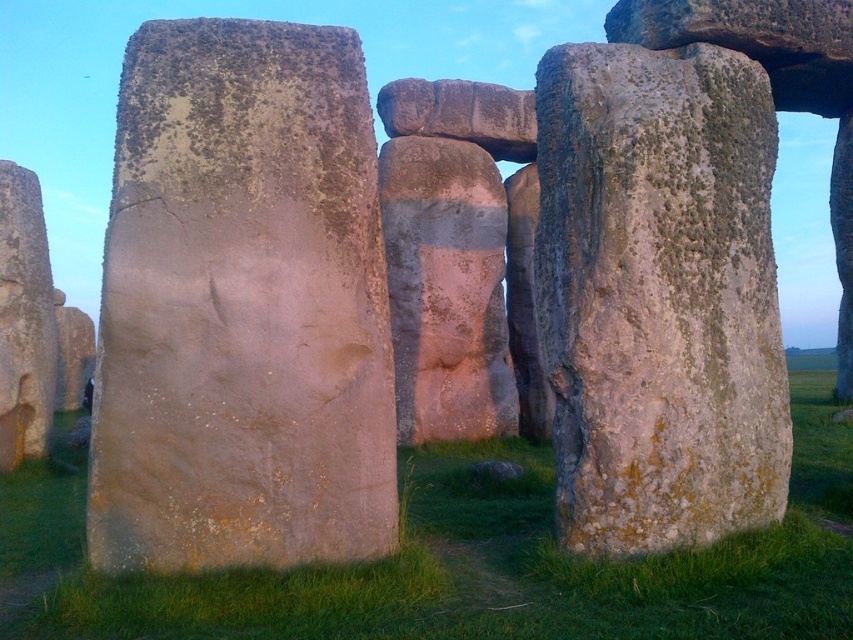
You are a tour guide explaining Stonehenge to visitors. You point out the speckled stone boulder at center and the green grass at center. Which of these two is taller?

The speckled stone boulder at center is taller than the green grass at center.

Based on the photo, you are a tourist standing at the edge of Stonehenge and see the speckled stone boulder at center and the green grass at center. Which object is higher in elevation?

The speckled stone boulder at center is above the green grass at center, so it is higher in elevation.